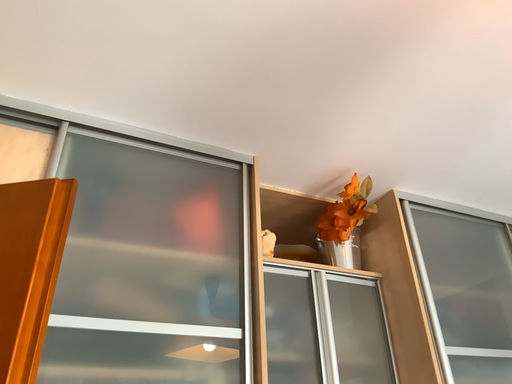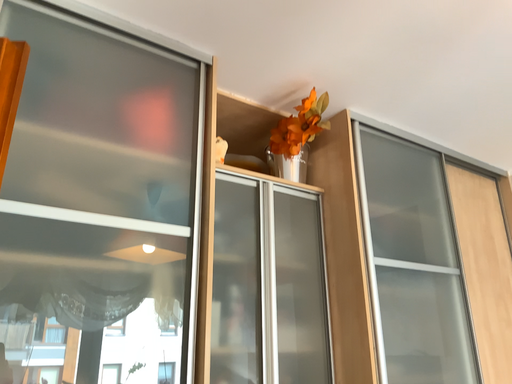
Question: Which way did the camera rotate in the video?

Choices:
 (A) rotated upward
 (B) rotated downward

Answer: (B)